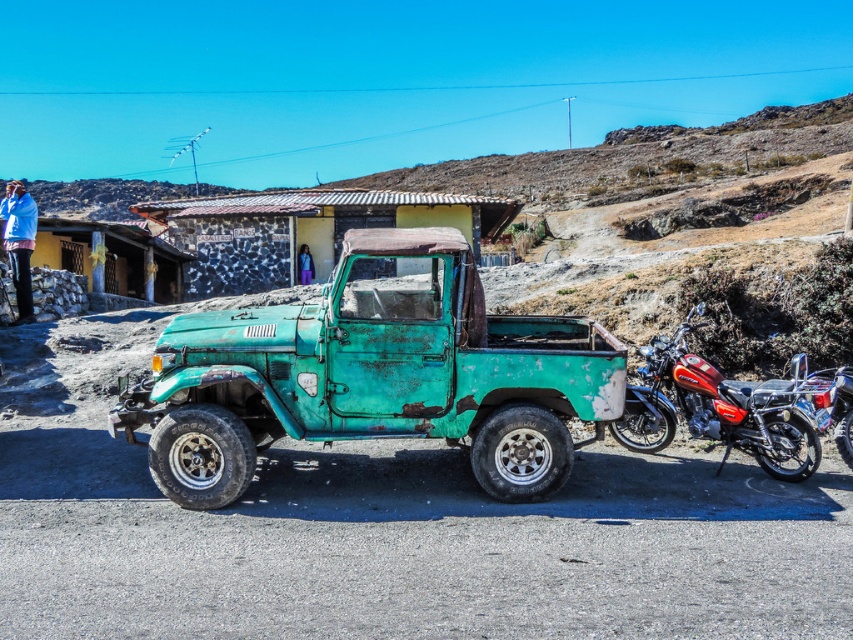
Who is positioned more to the left, rustic stone hut at center or blue fabric jacket at upper left?

Positioned to the left is blue fabric jacket at upper left.

Which of these two, rustic stone hut at center or blue fabric jacket at upper left, stands shorter?

blue fabric jacket at upper left

Describe the element at coordinates (303, 230) in the screenshot. I see `rustic stone hut at center` at that location.

At what (x,y) coordinates should I click in order to perform the action: click on rustic stone hut at center. Please return your answer as a coordinate pair (x, y). The height and width of the screenshot is (640, 853). Looking at the image, I should click on (303, 230).

Is rusty teal truck at center taller than shiny red motorcycle at right?

No.

In the scene shown: Does rusty teal truck at center have a greater width compared to shiny red motorcycle at right?

No.

Who is more forward, (402, 308) or (656, 426)?

Positioned in front is point (402, 308).

Find the location of a particular element. This screenshot has width=853, height=640. rusty teal truck at center is located at coordinates (374, 374).

Is point (401, 396) positioned before point (198, 243)?

Yes, point (401, 396) is closer to viewer.

Does rusty teal truck at center have a larger size compared to rustic stone hut at center?

Incorrect, rusty teal truck at center is not larger than rustic stone hut at center.

Where is `rusty teal truck at center`? The width and height of the screenshot is (853, 640). rusty teal truck at center is located at coordinates (374, 374).

Where is `rusty teal truck at center`? rusty teal truck at center is located at coordinates (374, 374).